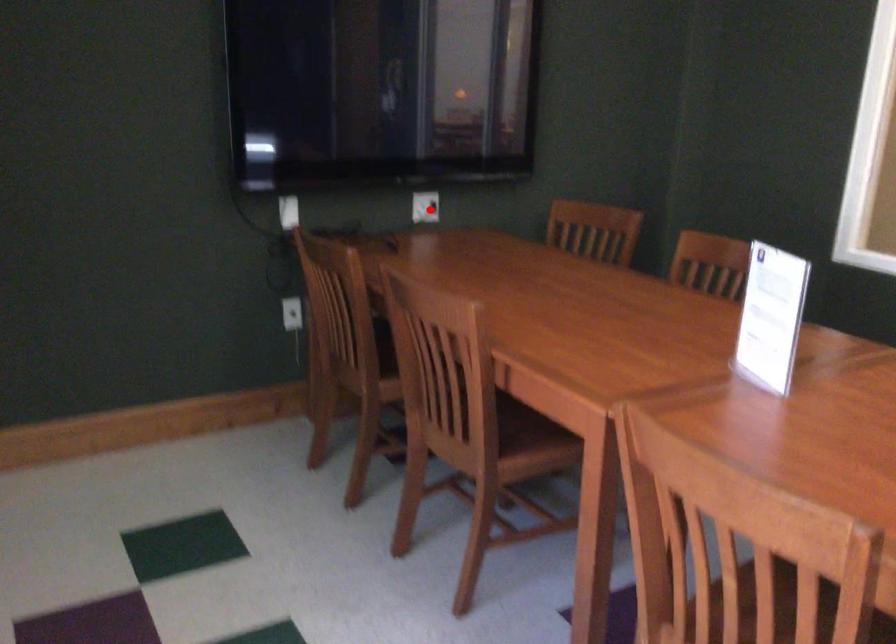
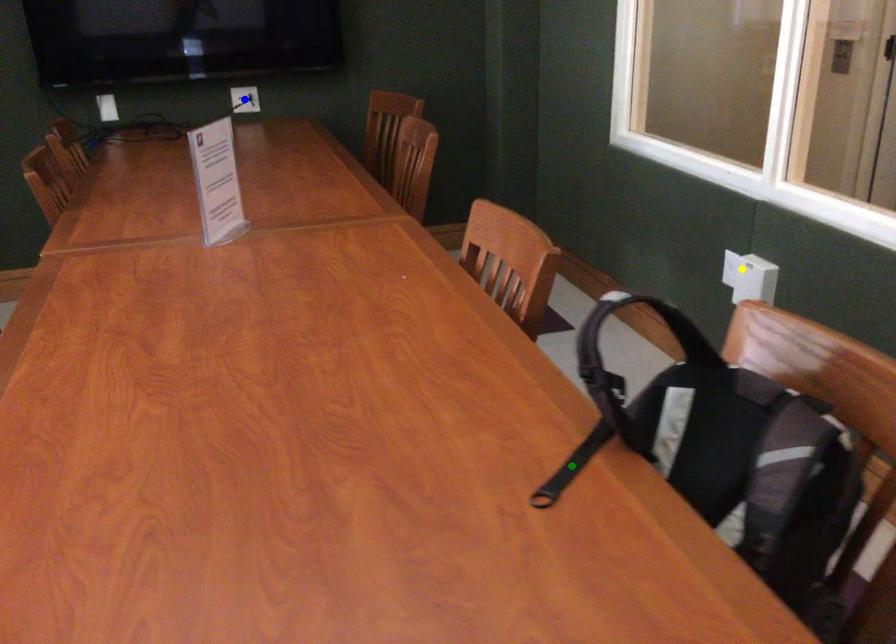
Question: I am providing you with two images of the same scene from different viewpoints. A red point is marked on the first image. You are given multiple points on the second image. Which point in image 2 is actually the same real-world point as the red point in image 1?

Choices:
 (A) yellow point
 (B) blue point
 (C) green point

Answer: (B)